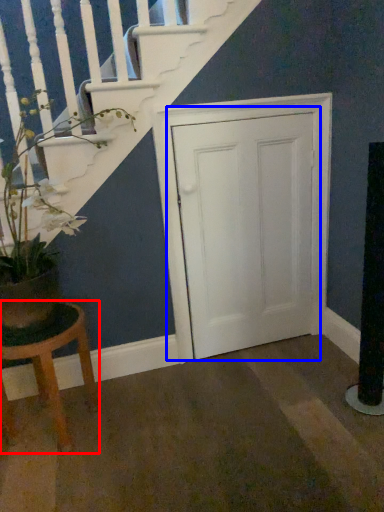
Question: Which point is further to the camera, stool (highlighted by a red box) or door (highlighted by a blue box)?

Choices:
 (A) stool
 (B) door

Answer: (B)